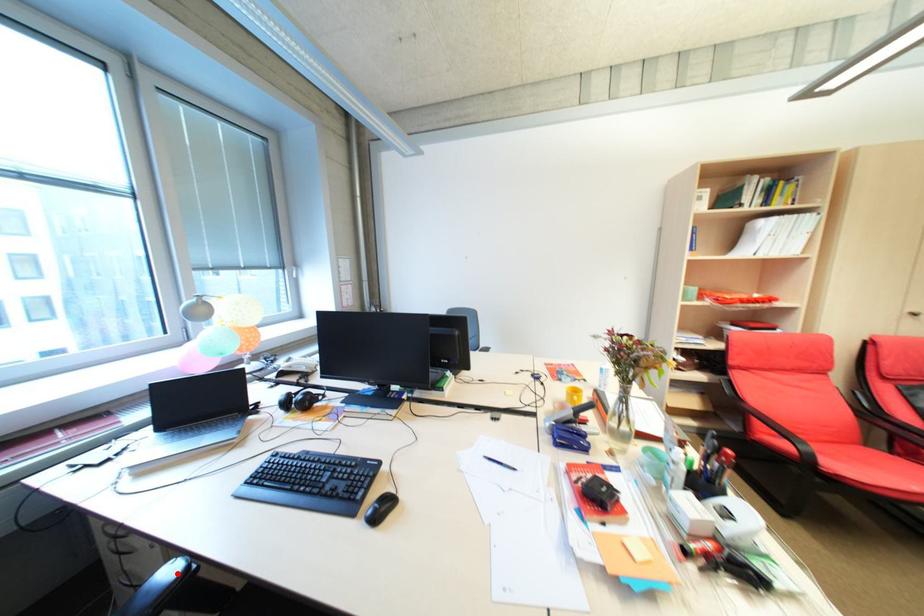
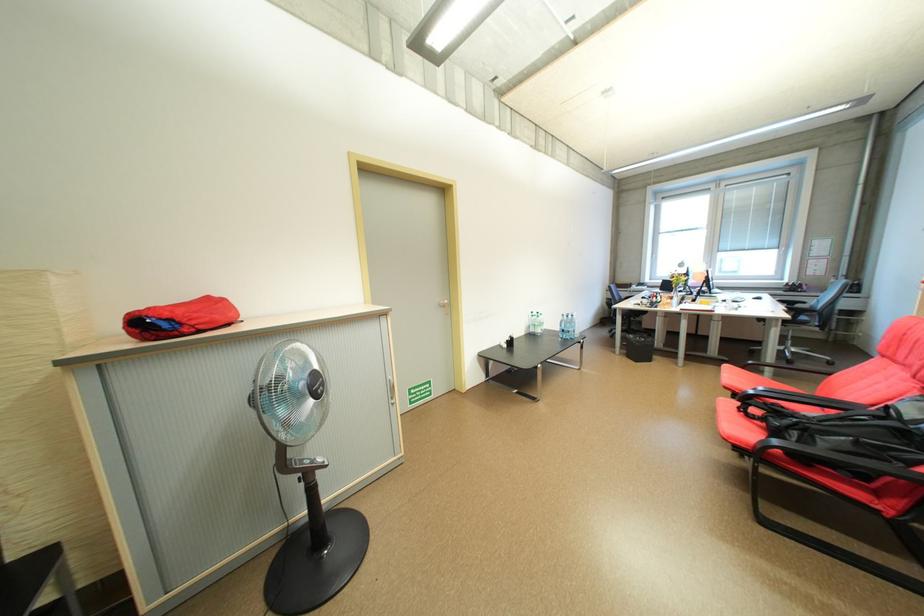
Question: I am providing you with two images of the same scene from different viewpoints. A red point is marked on the first image. Is the red point's position out of view in image 2?

Choices:
 (A) Yes
 (B) No

Answer: (A)